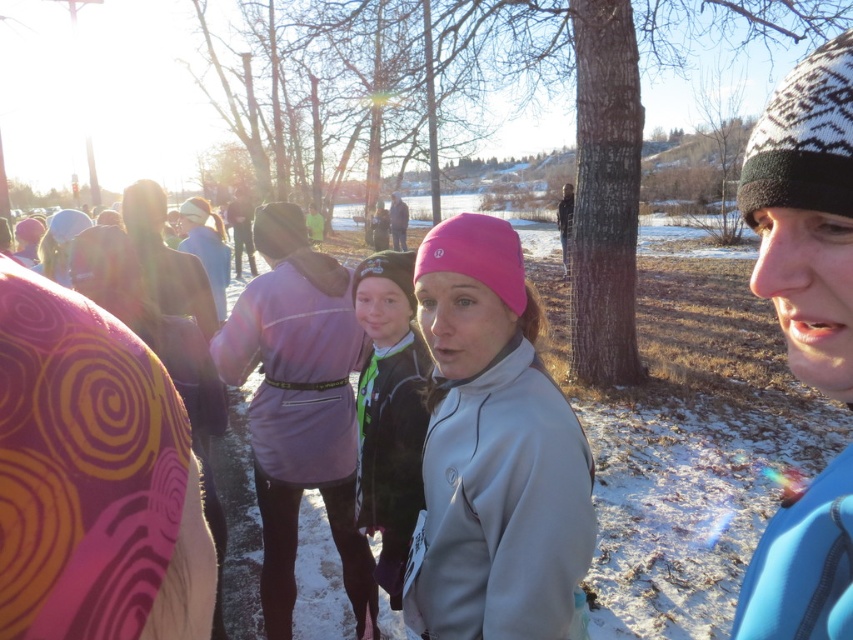
In the scene shown: Is white knit hat at right wider than black fleece jacket at center?

Yes.

This screenshot has height=640, width=853. Describe the element at coordinates (805, 214) in the screenshot. I see `white knit hat at right` at that location.

Which is behind, point (741, 630) or point (370, 428)?

Positioned behind is point (370, 428).

You are a GUI agent. You are given a task and a screenshot of the screen. Output one action in this format:
    pyautogui.click(x=<x>, y=<y>)
    Task: Click on the white knit hat at right
    This screenshot has width=853, height=640.
    Given the screenshot: What is the action you would take?
    pyautogui.click(x=805, y=214)

Can you confirm if purple fleece jacket at center is taller than black fleece jacket at center?

Indeed, purple fleece jacket at center has a greater height compared to black fleece jacket at center.

What do you see at coordinates (299, 408) in the screenshot?
I see `purple fleece jacket at center` at bounding box center [299, 408].

Where is `purple fleece jacket at center`? The image size is (853, 640). purple fleece jacket at center is located at coordinates (299, 408).

Is pink fabric headband at center wider than purple fleece jacket at center?

Incorrect, pink fabric headband at center's width does not surpass purple fleece jacket at center's.

Is pink fabric headband at center to the left of purple fleece jacket at center from the viewer's perspective?

No, pink fabric headband at center is not to the left of purple fleece jacket at center.

What do you see at coordinates (492, 451) in the screenshot?
I see `pink fabric headband at center` at bounding box center [492, 451].

What are the coordinates of `pink fabric headband at center` in the screenshot? It's located at (492, 451).